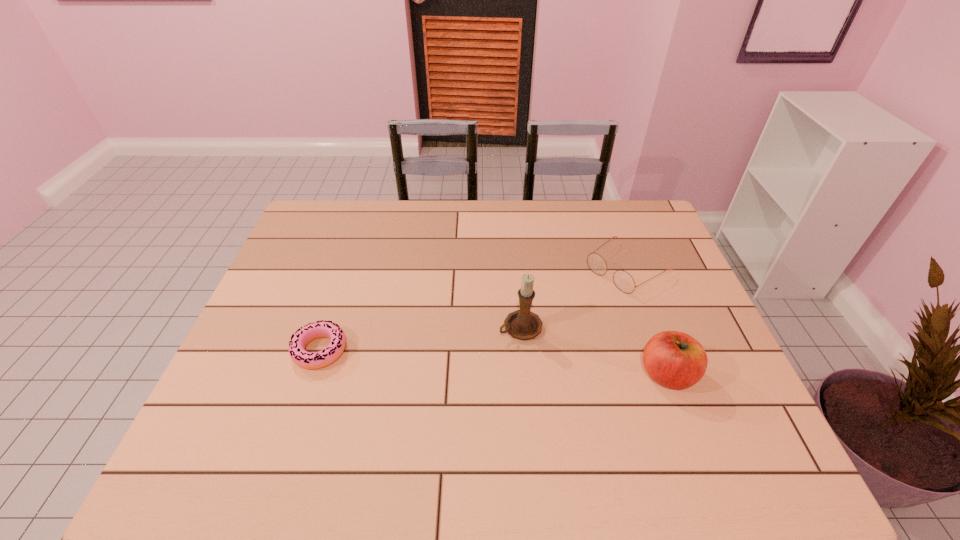
At what (x,y) coordinates should I click in order to perform the action: click on vacant point at the far edge. Please return your answer as a coordinate pair (x, y). Image resolution: width=960 pixels, height=540 pixels. Looking at the image, I should click on (529, 218).

Image resolution: width=960 pixels, height=540 pixels. In the image, there is a desktop. What are the coordinates of `vacant area at the near edge` in the screenshot? It's located at (294, 403).

Where is `vacant space at the left edge`? This screenshot has width=960, height=540. vacant space at the left edge is located at coordinates (289, 382).

This screenshot has width=960, height=540. I want to click on vacant space at the right edge of the desktop, so click(704, 382).

Locate an element on the screen. This screenshot has width=960, height=540. vacant area between the farthest object and the second object from left to right is located at coordinates (573, 298).

The image size is (960, 540). Identify the location of free space between the leftmost object and the second object from left to right. (420, 339).

Locate an element on the screen. This screenshot has width=960, height=540. free point between the apple and the shortest object is located at coordinates (493, 362).

Locate an element on the screen. This screenshot has height=540, width=960. unoccupied area between the third shortest object and the tallest object is located at coordinates (594, 351).

Find the location of a particular element. The width and height of the screenshot is (960, 540). vacant point located between the leftmost object and the third tallest object is located at coordinates (473, 309).

Where is `unoccupied position between the apple and the spectacles`? The width and height of the screenshot is (960, 540). unoccupied position between the apple and the spectacles is located at coordinates pyautogui.click(x=647, y=322).